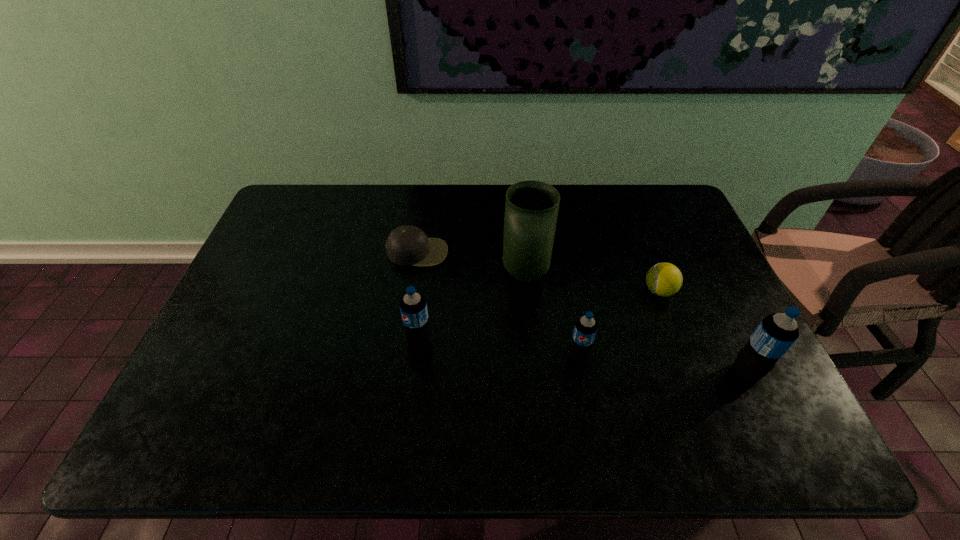
Locate an element on the screen. This screenshot has height=540, width=960. free space located 0.120m on the right of the second soda bottle from left to right is located at coordinates (637, 356).

At what (x,y) coordinates should I click in order to perform the action: click on vacant space situated on the left of the rightmost soda bottle. Please return your answer as a coordinate pair (x, y). Looking at the image, I should click on (681, 372).

You are a GUI agent. You are given a task and a screenshot of the screen. Output one action in this format:
    pyautogui.click(x=<x>, y=<y>)
    Task: Click on the free space located on the brim of the cap
    The height and width of the screenshot is (540, 960).
    Given the screenshot: What is the action you would take?
    pyautogui.click(x=400, y=369)

In order to click on free space located 0.210m on the front of the fifth object from left to right in this screenshot , I will do pyautogui.click(x=689, y=370).

Where is `vacant space located on the right of the vase`? The width and height of the screenshot is (960, 540). vacant space located on the right of the vase is located at coordinates (641, 274).

The image size is (960, 540). What are the coordinates of `object present at the near edge` in the screenshot? It's located at (776, 333).

Where is `soda bottle at the right edge`? soda bottle at the right edge is located at coordinates (776, 333).

Locate an element on the screen. tennis ball situated at the right edge is located at coordinates (663, 279).

Identify the location of object that is at the near right corner. (776, 333).

In the image, there is a desktop. Identify the location of vacant space at the far edge. (412, 197).